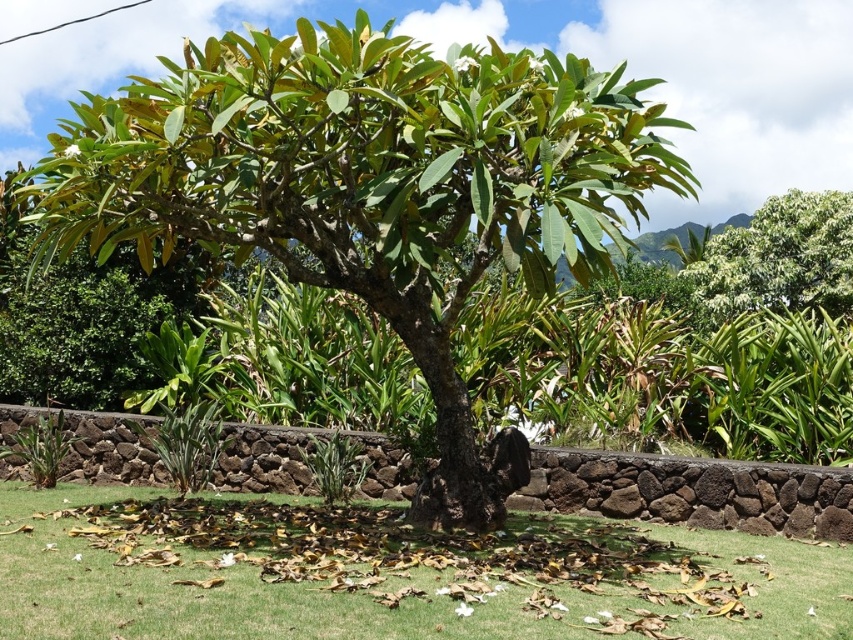
Question: Is green leafy tree at center positioned in front of green grass at center?

Choices:
 (A) no
 (B) yes

Answer: (A)

Question: Which is farther from the green leafy tree at upper right?

Choices:
 (A) green leafy tree at center
 (B) green grass at center

Answer: (B)

Question: Which object appears farthest from the camera in this image?

Choices:
 (A) green leafy tree at upper right
 (B) green grass at center
 (C) green leafy tree at center

Answer: (A)

Question: Is green grass at center wider than green leafy tree at upper right?

Choices:
 (A) yes
 (B) no

Answer: (B)

Question: Is green grass at center closer to camera compared to green leafy tree at upper right?

Choices:
 (A) yes
 (B) no

Answer: (A)

Question: Which of the following is the closest to the observer?

Choices:
 (A) green leafy tree at center
 (B) green leafy tree at upper right
 (C) green grass at center

Answer: (C)